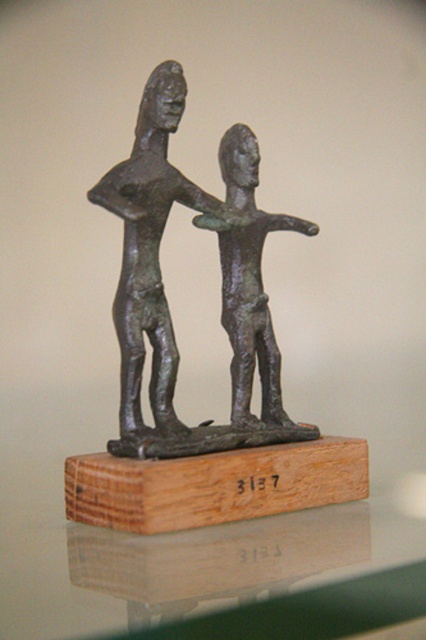
You are standing in front of the bronze sculpture on the wooden base. The camera is positioned at point (236, 346). If you want to take a photo of the sculpture from the camera position, will you be able to see both figures clearly in the frame?

The camera is positioned at point (236, 346), which is 3.89 feet away from the sculpture. Since the distance is sufficient to capture the entire sculpture, both figures will be clearly visible in the frame.

You are an interior designer planning to place a new sofa in the living room. The sofa is 1.8 meters wide. You see the transparent glass table at center and the bronze statue at center. Can the sofa fit between the two objects if placed directly between them?

The transparent glass table at center is wider than the bronze statue at center. However, since the exact distance between them isn